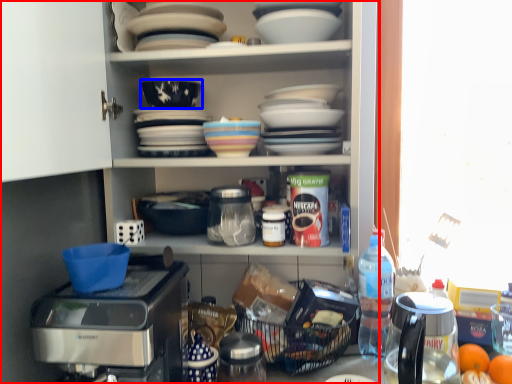
Question: Which object is closer to the camera taking this photo, cabinetry (highlighted by a red box) or bowl (highlighted by a blue box)?

Choices:
 (A) cabinetry
 (B) bowl

Answer: (A)